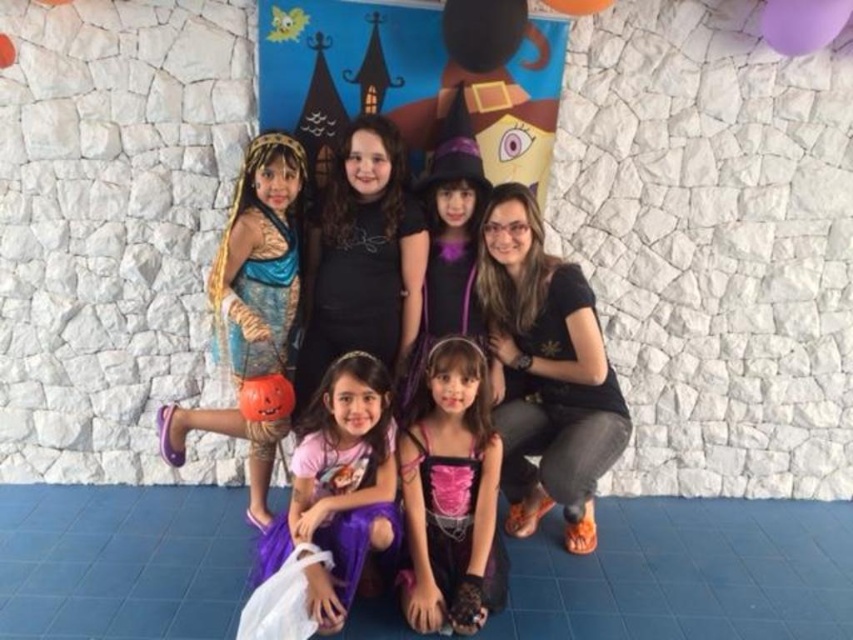
You are standing in front of the group of people in the Halloween photo. There are two points marked on the floor at coordinates point (334, 221) and point (338, 300). Which point is closer to the wall?

Point (334, 221) is behind point (338, 300), so the point closer to the wall would be point (334, 221).